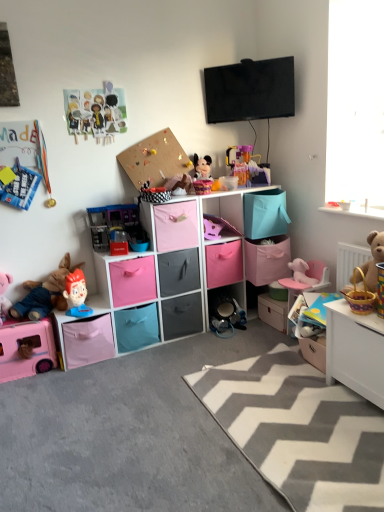
Question: Is point (339, 327) positioned closer to the camera than point (79, 293)?

Choices:
 (A) farther
 (B) closer

Answer: (B)

Question: Do you think white glossy table at lower right is within plastic toy at left, the third toy from the left, or outside of it?

Choices:
 (A) inside
 (B) outside

Answer: (B)

Question: Estimate the real-world distances between objects in this image. Which object is closer to the pink fabric cabinet at center, the first cabinet positioned from the top?

Choices:
 (A) plastic toy at left, the third toy from the left
 (B) transparent glass window at upper right
 (C) plastic play kitchen at center, which is the 5th toy from left to right
 (D) pink fabric plush at center, positioned as the 7th toy in left-to-right order
 (E) pink fabric stuffed animal at center-right, acting as the ninth toy starting from the left

Answer: (D)

Question: Which object is the closest to the pink fabric drawer at center, which is the first drawer from left to right?

Choices:
 (A) matte black drawer at center, the fourth drawer positioned from the right
 (B) plush fabric toy at left, which is the 9th toy in right-to-left order
 (C) pink fabric drawer at center, the fifth drawer viewed from the right
 (D) metallic gray cabinet at lower right, the first cabinet ordered from the bottom
 (E) white glossy table at lower right

Answer: (C)